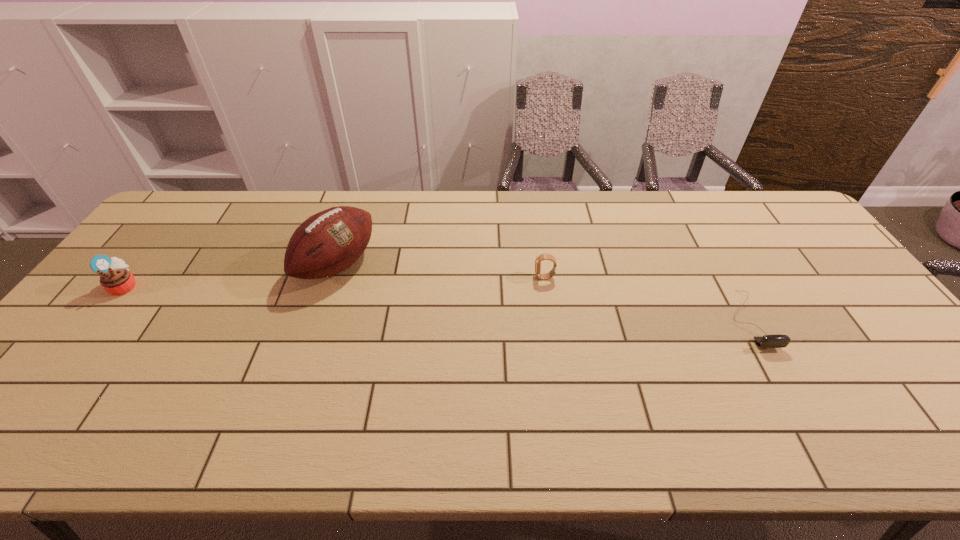
In the image, there is a desktop. Where is `vacant space at the far right corner`? This screenshot has height=540, width=960. vacant space at the far right corner is located at coordinates (770, 221).

I want to click on vacant space that is in between the webcam and the third object from left to right, so click(x=647, y=299).

You are a GUI agent. You are given a task and a screenshot of the screen. Output one action in this format:
    pyautogui.click(x=<x>, y=<y>)
    Task: Click on the vacant area that lies between the rightmost object and the leftmost object
    
    Given the screenshot: What is the action you would take?
    pyautogui.click(x=437, y=303)

Locate an element on the screen. This screenshot has height=540, width=960. free space between the third object from left to right and the webcam is located at coordinates (647, 299).

I want to click on free space between the muffin and the third object from right to left, so click(x=231, y=275).

This screenshot has height=540, width=960. I want to click on empty location between the third tallest object and the football (American), so pos(441,271).

Locate an element on the screen. free spot between the third tallest object and the webcam is located at coordinates (647, 299).

The width and height of the screenshot is (960, 540). What are the coordinates of `free space between the second object from left to right and the second shortest object` in the screenshot? It's located at (441, 271).

Locate an element on the screen. The image size is (960, 540). empty space between the tallest object and the leftmost object is located at coordinates (231, 275).

Image resolution: width=960 pixels, height=540 pixels. I want to click on vacant area between the third object from left to right and the second object from left to right, so click(x=441, y=271).